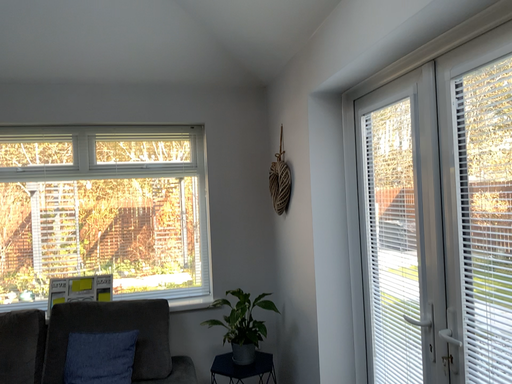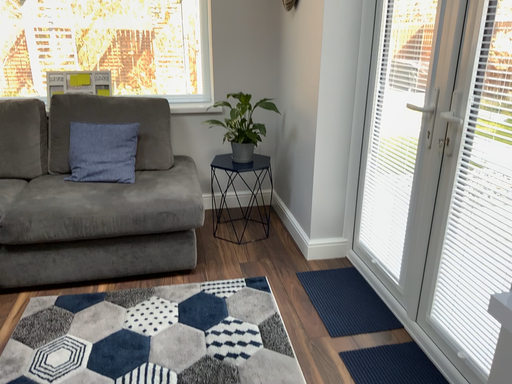
Question: How did the camera likely rotate when shooting the video?

Choices:
 (A) rotated downward
 (B) rotated upward

Answer: (A)